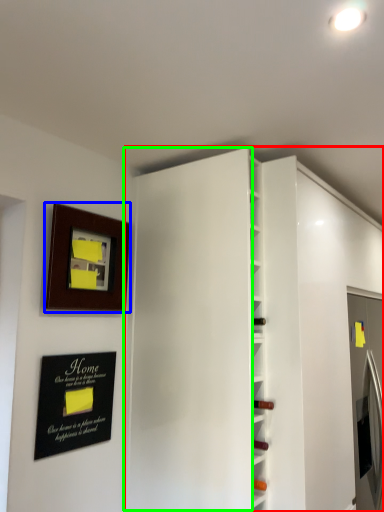
Question: Which object is the farthest from bookshelf (highlighted by a red box)? Choose among these: picture frame (highlighted by a blue box) or door (highlighted by a green box).

Choices:
 (A) picture frame
 (B) door

Answer: (A)